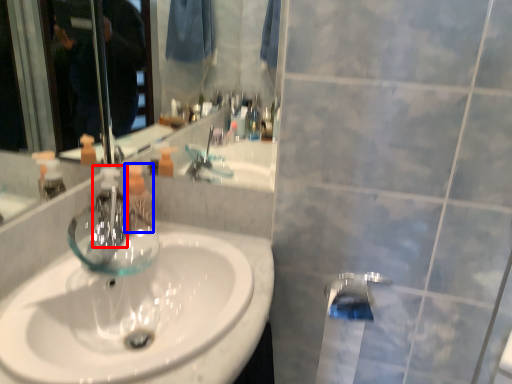
Question: Which point is closer to the camera, faucet (highlighted by a red box) or mouthwash (highlighted by a blue box)?

Choices:
 (A) faucet
 (B) mouthwash

Answer: (A)